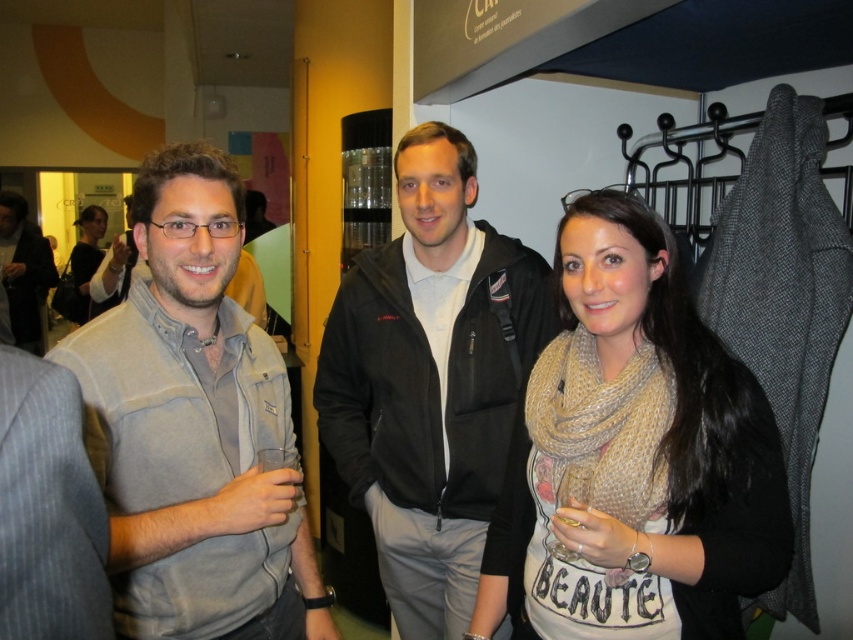
Who is more forward, (152, 605) or (80, 236)?

Point (152, 605) is more forward.

Does gray fleece vest at left appear under matte gray scarf at center?

Correct, gray fleece vest at left is located below matte gray scarf at center.

This screenshot has width=853, height=640. What are the coordinates of `gray fleece vest at left` in the screenshot? It's located at (194, 428).

Does knitted beige scarf at center have a lesser width compared to gray fleece vest at left?

In fact, knitted beige scarf at center might be wider than gray fleece vest at left.

Between knitted beige scarf at center and gray fleece vest at left, which one is positioned higher?

gray fleece vest at left is higher up.

Identify the location of knitted beige scarf at center. coord(633,456).

Between gray fleece vest at left and gray fleece jacket at left, which one appears on the right side from the viewer's perspective?

gray fleece vest at left is more to the right.

Is gray fleece vest at left shorter than gray fleece jacket at left?

Indeed, gray fleece vest at left has a lesser height compared to gray fleece jacket at left.

Between point (231, 593) and point (10, 298), which one is positioned in front?

Point (231, 593) is more forward.

Locate an element on the screen. This screenshot has height=640, width=853. gray fleece vest at left is located at coordinates (194, 428).